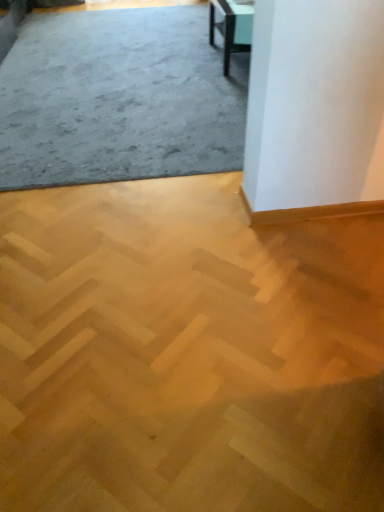
Question: Considering their positions, is matte black table at upper right located in front of or behind gray carpet at upper left, acting as the 1th concrete starting from the back?

Choices:
 (A) front
 (B) behind

Answer: (B)

Question: Considering the positions of matte black table at upper right and gray carpet at upper left, the second concrete when ordered from front to back, in the image, is matte black table at upper right taller or shorter than gray carpet at upper left, the second concrete when ordered from front to back,?

Choices:
 (A) short
 (B) tall

Answer: (B)

Question: Which of these objects is positioned closest to the matte black table at upper right?

Choices:
 (A) light brown wood parquet at center, the 2th concrete from the back
 (B) gray carpet at upper left, which appears as the 2th concrete when ordered from the bottom

Answer: (B)

Question: Which is nearer to the light brown wood parquet at center, which is the 2th concrete from top to bottom?

Choices:
 (A) matte black table at upper right
 (B) gray carpet at upper left, acting as the 1th concrete starting from the back

Answer: (B)